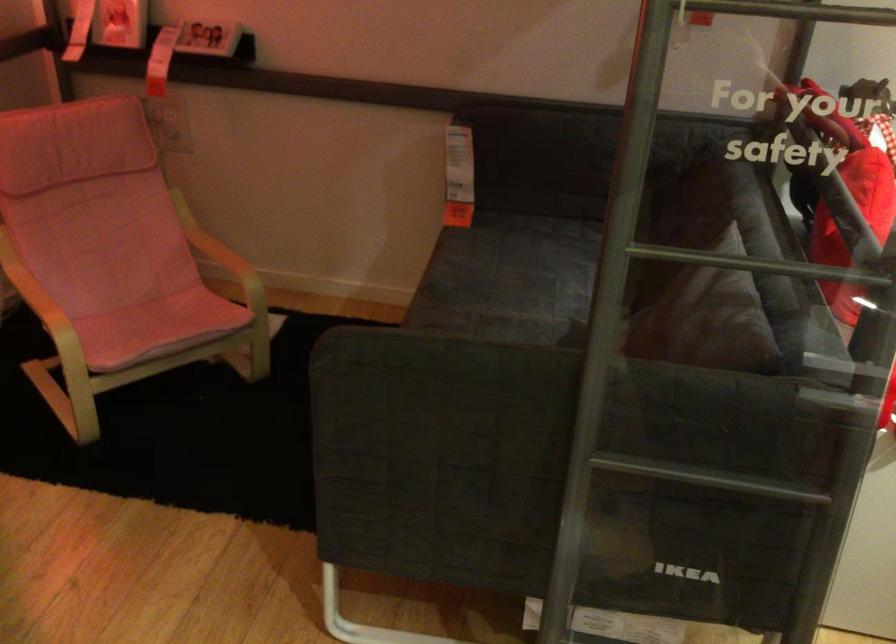
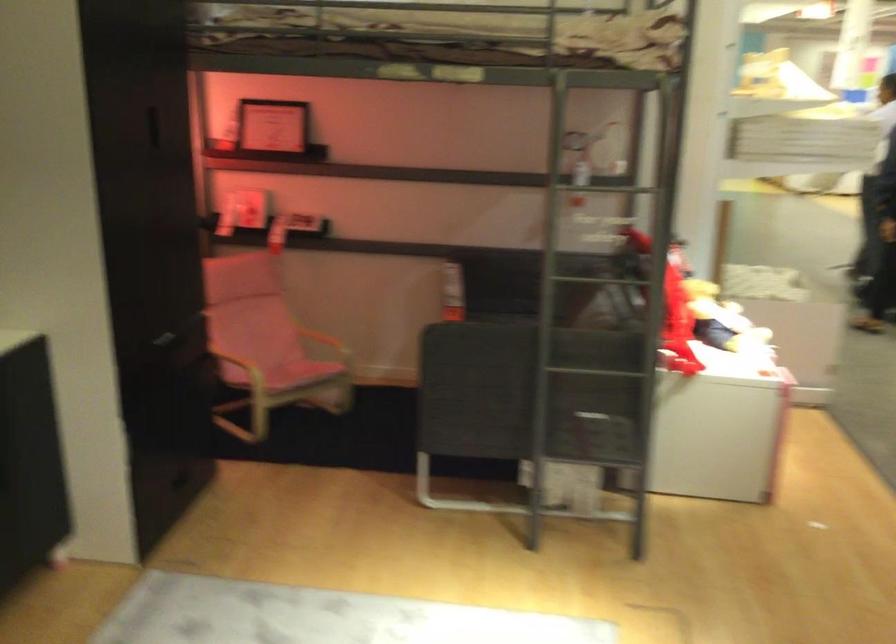
Locate, in the second image, the point that corresponds to (440,189) in the first image.

(452, 292)